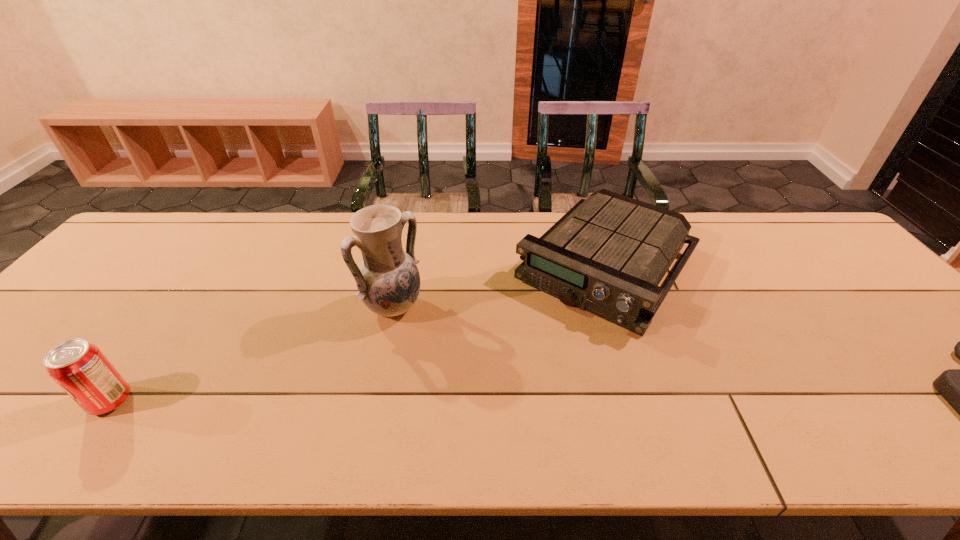
Where is `blank region between the third object from left to right and the third object from right to left`? Image resolution: width=960 pixels, height=540 pixels. blank region between the third object from left to right and the third object from right to left is located at coordinates (500, 286).

At what (x,y) coordinates should I click in order to perform the action: click on empty space between the leftmost object and the radio receiver. Please return your answer as a coordinate pair (x, y). Looking at the image, I should click on (359, 333).

What are the coordinates of `vacant point located between the pottery and the leftmost object` in the screenshot? It's located at (252, 354).

Identify the location of free area in between the leftmost object and the third object from right to left. (252, 354).

In order to click on vacant area that lies between the leftmost object and the third object from left to right in this screenshot , I will do click(359, 333).

The image size is (960, 540). Find the location of `object that stands as the second closest to the tallest object`. object that stands as the second closest to the tallest object is located at coordinates (80, 368).

Identify which object is the second nearest to the rightmost object. Please provide its 2D coordinates. Your answer should be formatted as a tuple, i.e. [(x, y)], where the tuple contains the x and y coordinates of a point satisfying the conditions above.

[(388, 281)]

I want to click on vacant region that satisfies the following two spatial constraints: 1. on the back side of the soda; 2. on the left side of the second object from right to left, so click(x=209, y=265).

Locate an element on the screen. Image resolution: width=960 pixels, height=540 pixels. vacant space that satisfies the following two spatial constraints: 1. on the back side of the shortest object; 2. on the right side of the tallest object is located at coordinates (402, 265).